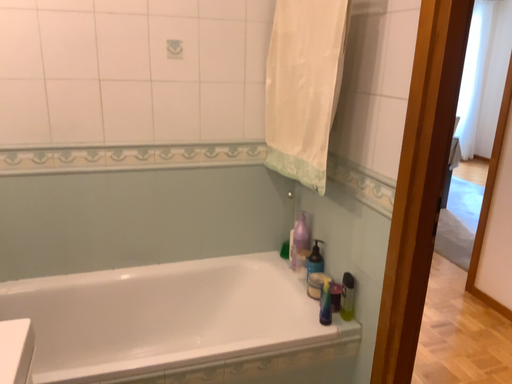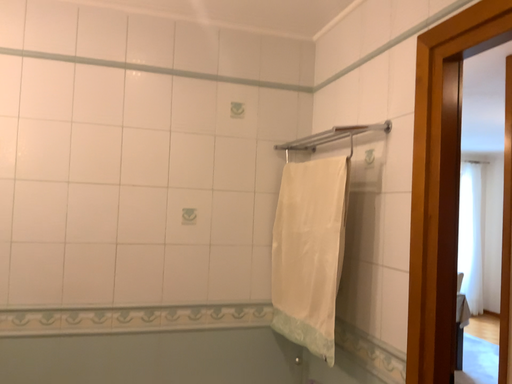
Question: Which way did the camera rotate in the video?

Choices:
 (A) rotated downward
 (B) rotated upward

Answer: (B)